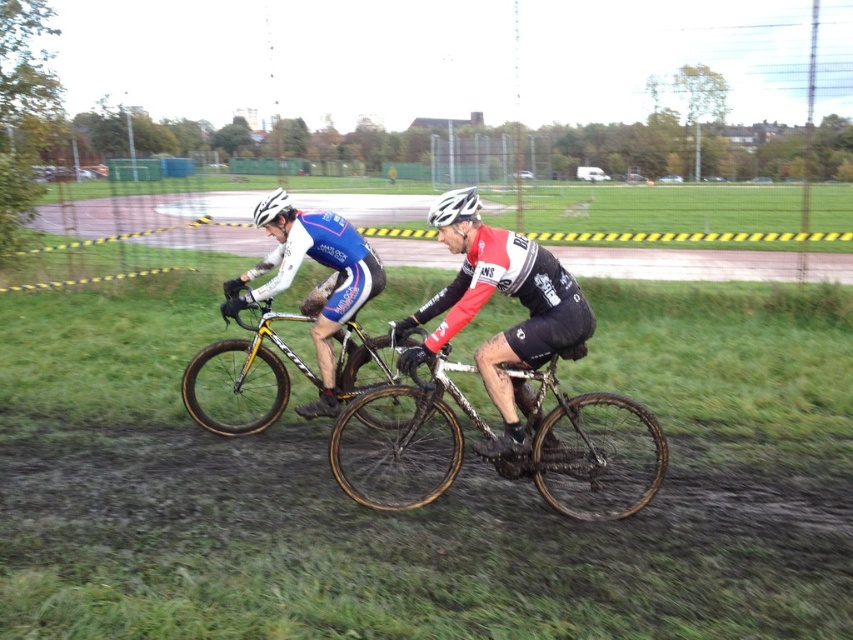
Question: From the image, what is the correct spatial relationship of shiny black cycling jersey at center in relation to white matte bicycle helmet at upper center?

Choices:
 (A) above
 (B) below

Answer: (B)

Question: Among these objects, which one is nearest to the camera?

Choices:
 (A) yellow matte bicycle at center
 (B) white matte bicycle helmet at upper center
 (C) shiny black cycling jersey at center

Answer: (C)

Question: Which point is farther to the camera?

Choices:
 (A) (409, 353)
 (B) (280, 401)
 (C) (604, 488)

Answer: (B)

Question: Can you confirm if shiny black cycling jersey at center is positioned to the left of matte blue cycling jersey at center?

Choices:
 (A) no
 (B) yes

Answer: (A)

Question: Which object is the farthest from the yellow matte bicycle at center?

Choices:
 (A) muddy metallic bicycle at center
 (B) matte blue cycling jersey at center
 (C) white matte bicycle helmet at upper center

Answer: (C)

Question: Is shiny black cycling jersey at center below white matte bicycle helmet at upper center?

Choices:
 (A) yes
 (B) no

Answer: (A)